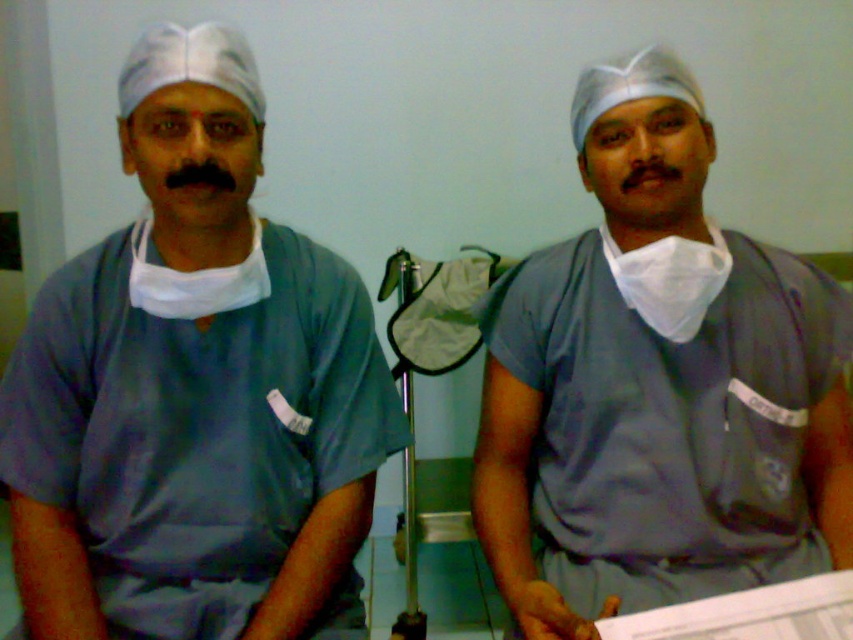
Can you confirm if matte blue scrubs at center is wider than gray matte scrubs at center?

No, matte blue scrubs at center is not wider than gray matte scrubs at center.

Measure the distance between point (99,326) and camera.

They are 1.06 meters apart.

Locate an element on the screen. The width and height of the screenshot is (853, 640). matte blue scrubs at center is located at coordinates (195, 392).